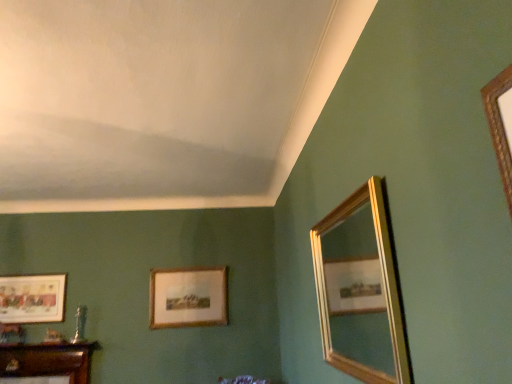
Question: In the image, is gold-framed picture at center, which appears as the second picture frame when viewed from the left, positioned in front of or behind gold-framed mirror at right?

Choices:
 (A) behind
 (B) front

Answer: (A)

Question: In terms of width, does gold-framed picture at center, acting as the first picture frame starting from the right, look wider or thinner when compared to gold-framed mirror at right?

Choices:
 (A) thin
 (B) wide

Answer: (A)

Question: Which is farther from the gold-framed picture at center, acting as the first picture frame starting from the right?

Choices:
 (A) gold-framed mirror at right
 (B) matte gold picture frame at lower left, arranged as the second picture frame when viewed from the right

Answer: (A)

Question: Estimate the real-world distances between objects in this image. Which object is closer to the matte gold picture frame at lower left, arranged as the second picture frame when viewed from the right?

Choices:
 (A) gold-framed picture at center, acting as the first picture frame starting from the right
 (B) gold-framed mirror at right

Answer: (A)